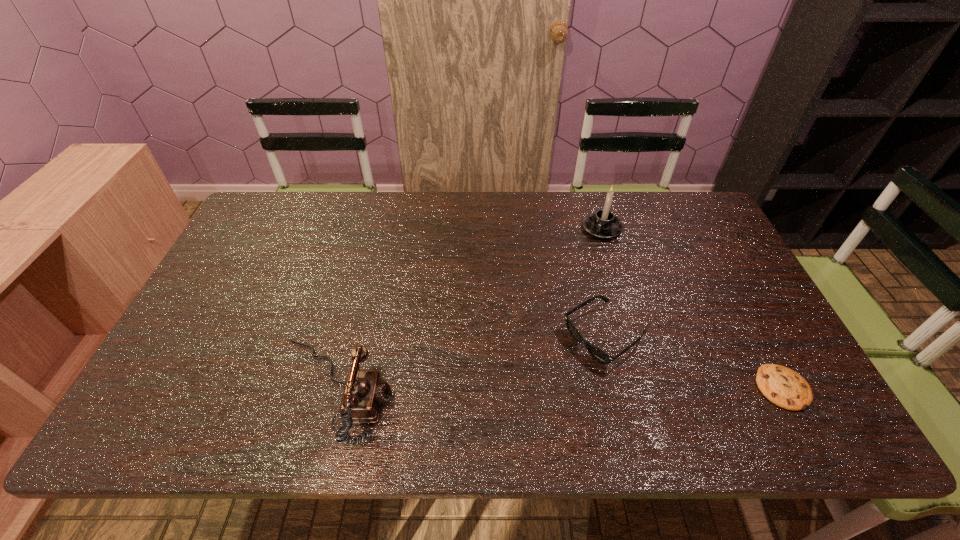
I want to click on object that is at the near right corner, so click(x=782, y=386).

Identify the location of vacant space at the far edge of the desktop. The width and height of the screenshot is (960, 540). (319, 235).

Find the location of a particular element. Image resolution: width=960 pixels, height=540 pixels. free space at the left edge of the desktop is located at coordinates (244, 245).

The height and width of the screenshot is (540, 960). Identify the location of free space at the right edge. (756, 341).

Where is `unoccupied position between the shortest object and the candle holder`? Image resolution: width=960 pixels, height=540 pixels. unoccupied position between the shortest object and the candle holder is located at coordinates (692, 308).

Locate an element on the screen. free spot between the rightmost object and the tallest object is located at coordinates (692, 308).

Find the location of `vacant region between the rightmost object and the candle holder`. vacant region between the rightmost object and the candle holder is located at coordinates (692, 308).

I want to click on free space that is in between the shortest object and the third tallest object, so click(693, 362).

The image size is (960, 540). In order to click on free space between the tallest object and the third shortest object in this screenshot , I will do `click(468, 309)`.

Image resolution: width=960 pixels, height=540 pixels. Find the location of `vacant area that lies between the tallest object and the leftmost object`. vacant area that lies between the tallest object and the leftmost object is located at coordinates (468, 309).